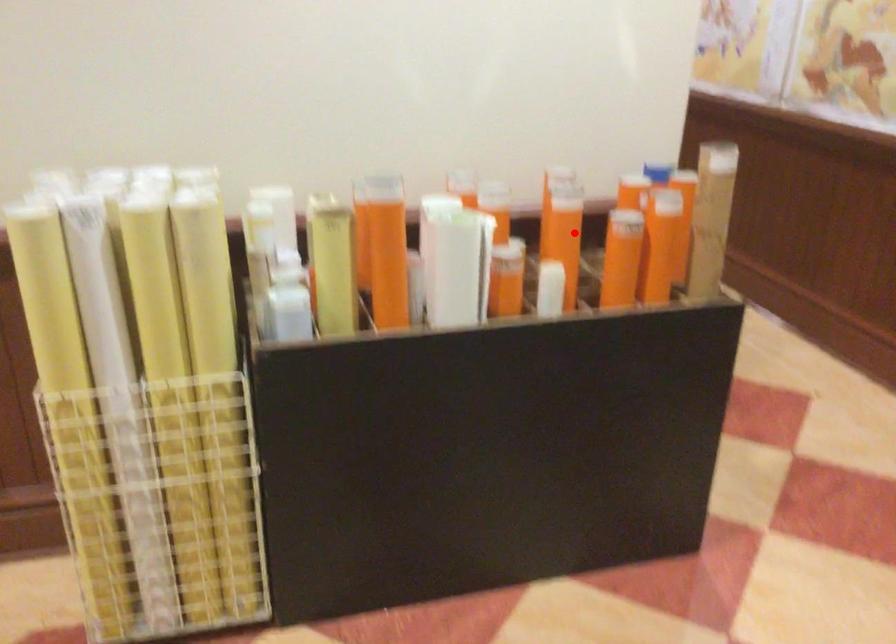
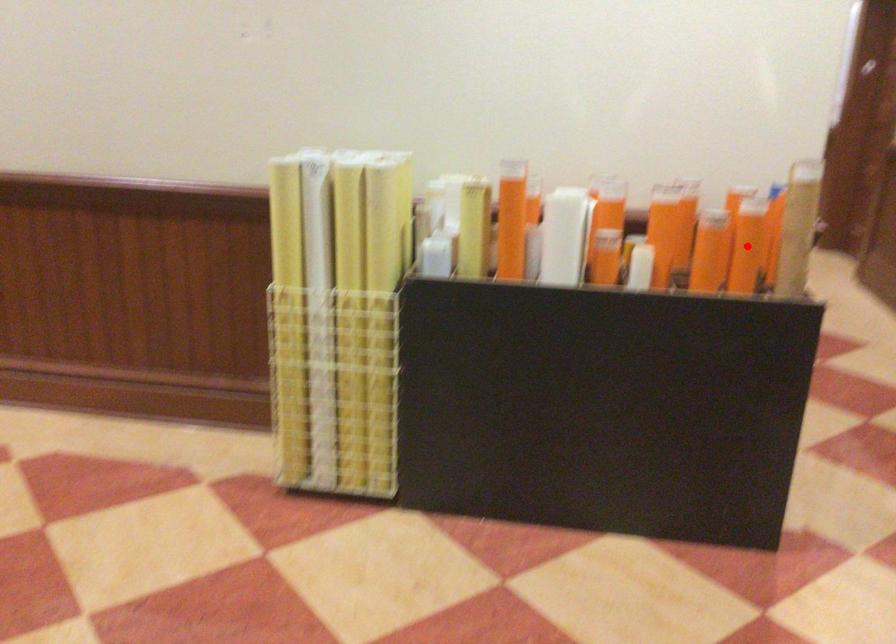
I am providing you with two images of the same scene from different viewpoints. A red point is marked on the first image and another point is marked on the second image. Is the red point in image1 aligned with the point shown in image2?

No